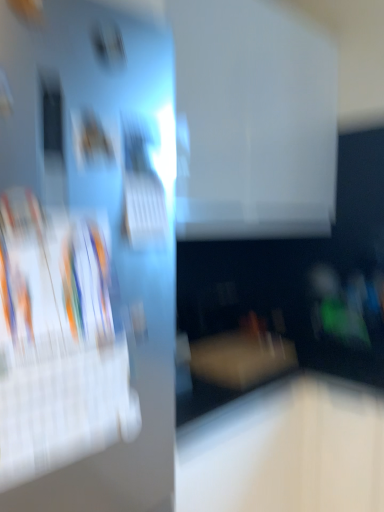
Question: Could you tell me if white glossy magazine at left is turned towards matte wood coffee table at center?

Choices:
 (A) yes
 (B) no

Answer: (B)

Question: From the image's perspective, is white glossy magazine at left below matte wood coffee table at center?

Choices:
 (A) no
 (B) yes

Answer: (A)

Question: Is white glossy magazine at left bigger than matte wood coffee table at center?

Choices:
 (A) no
 (B) yes

Answer: (B)

Question: Considering the relative sizes of white glossy magazine at left and matte wood coffee table at center in the image provided, is white glossy magazine at left thinner than matte wood coffee table at center?

Choices:
 (A) yes
 (B) no

Answer: (A)

Question: From a real-world perspective, is white glossy magazine at left on top of matte wood coffee table at center?

Choices:
 (A) yes
 (B) no

Answer: (A)

Question: Considering the relative positions of white glossy magazine at left and matte wood coffee table at center in the image provided, is white glossy magazine at left to the right of matte wood coffee table at center from the viewer's perspective?

Choices:
 (A) no
 (B) yes

Answer: (A)

Question: From the image's perspective, is matte wood coffee table at center beneath white glossy magazine at left?

Choices:
 (A) no
 (B) yes

Answer: (B)

Question: Is matte wood coffee table at center positioned before white glossy magazine at left?

Choices:
 (A) no
 (B) yes

Answer: (A)

Question: Can you confirm if matte wood coffee table at center is wider than white glossy magazine at left?

Choices:
 (A) no
 (B) yes

Answer: (B)

Question: Considering the relative sizes of matte wood coffee table at center and white glossy magazine at left in the image provided, is matte wood coffee table at center smaller than white glossy magazine at left?

Choices:
 (A) yes
 (B) no

Answer: (A)

Question: Is matte wood coffee table at center turned away from white glossy magazine at left?

Choices:
 (A) no
 (B) yes

Answer: (A)

Question: Could you tell me if matte wood coffee table at center is turned towards white glossy magazine at left?

Choices:
 (A) yes
 (B) no

Answer: (B)

Question: Considering the positions of point (19, 188) and point (249, 337), is point (19, 188) closer or farther from the camera than point (249, 337)?

Choices:
 (A) closer
 (B) farther

Answer: (A)